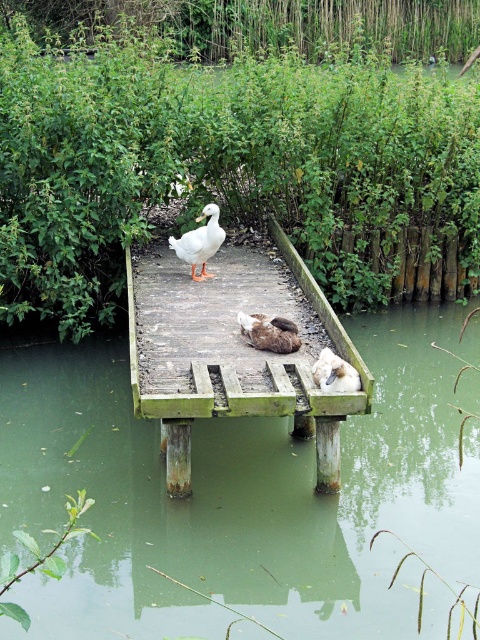
You are a photographer trying to capture the brown fuzzy duck at center from the greenish murky water at center. Which direction should you move your camera to keep the duck in frame while avoiding the water?

You should move your camera to the right to keep the brown fuzzy duck at center in frame while avoiding the greenish murky water at center, since the water is to the left of the duck.

From the picture: You are standing on the wooden platform and want to walk from point A to point B. Point A is at coordinates point (216, 218) and point B is at coordinates point (350, 372). Which direction should you walk to move from point A to point B?

To move from point A at coordinates point (216, 218) to point B at coordinates point (350, 372), you should walk forward since point A is behind point B.

You are standing on the wooden platform and want to place a small basket exactly where the white matte duck at center is currently standing. According to the coordinates provided, what are the coordinates where you should place the basket?

The white matte duck at center is located at point (200, 241), so you should place the basket at those coordinates.